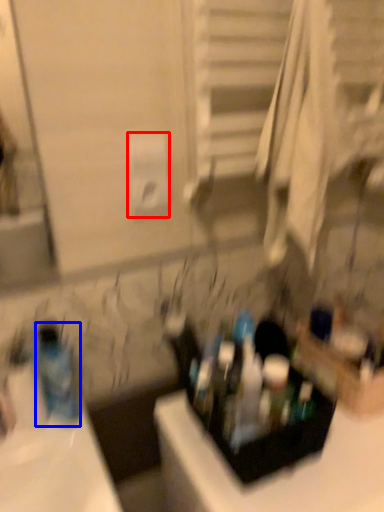
Question: Among these objects, which one is nearest to the camera, toilet paper (highlighted by a red box) or bottle (highlighted by a blue box)?

Choices:
 (A) toilet paper
 (B) bottle

Answer: (B)